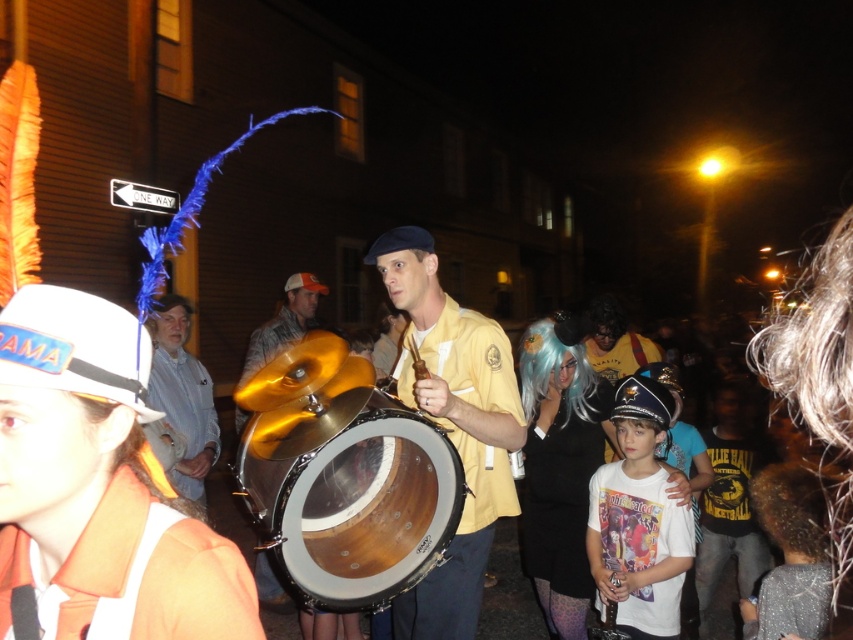
You are standing at the ONE WAY sign and want to take a photo of both point (x=386, y=240) and point (x=347, y=625) in the scene. Which point should you focus on first to ensure both are in sharp focus?

You should focus on point (x=386, y=240) first because it is closer to the camera than point (x=347, y=625). This ensures the closer point is in focus, and the farther point will also be within the depth of field.

You are a photographer trying to capture a photo of the wooden drum at center and the white matte shirt at center. Based on their positions, which object should you focus on first if you want to frame them from left to right?

The wooden drum at center is to the left of white matte shirt at center, so you should focus on the wooden drum at center first to frame them from left to right.

You are a photographer at the parade trying to capture both the white matte shirt at center and the white shirt at center in a single shot. Since you want to highlight the thinner one, which one should you focus on?

The white matte shirt at center is thinner than the white shirt at center, so you should focus on the white matte shirt at center to highlight the thinner one.